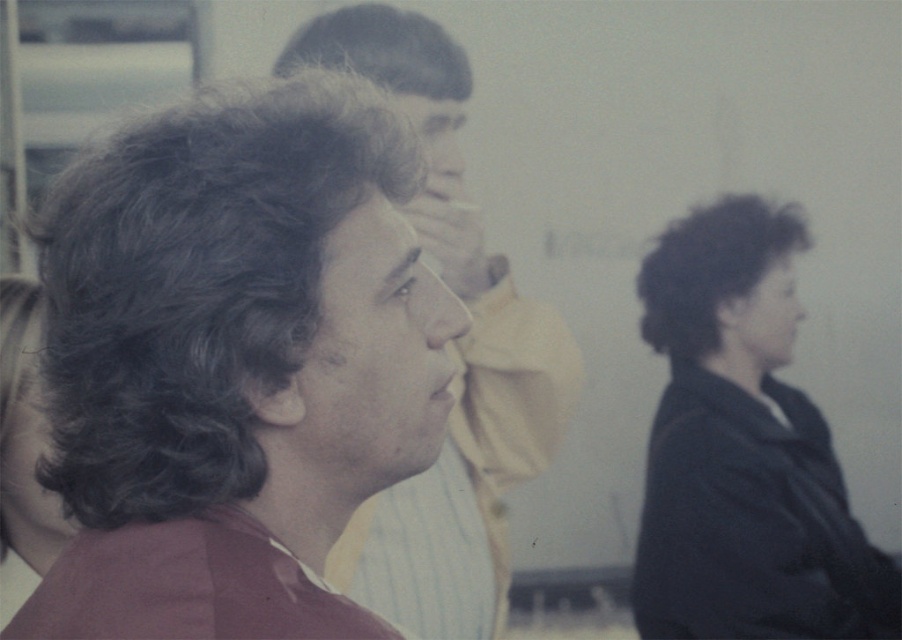
Question: Which point is farther to the camera?

Choices:
 (A) (448, 620)
 (B) (775, 602)

Answer: (B)

Question: Which object appears farthest from the camera in this image?

Choices:
 (A) dark brown hair at left
 (B) matte brown hair at center
 (C) black matte jacket at lower right

Answer: (C)

Question: Does dark brown hair at left appear over black matte jacket at lower right?

Choices:
 (A) no
 (B) yes

Answer: (B)

Question: Which point is farther from the camera taking this photo?

Choices:
 (A) (675, 324)
 (B) (376, 189)
 (C) (408, 29)

Answer: (A)

Question: Is dark brown hair at left to the left of matte brown hair at center from the viewer's perspective?

Choices:
 (A) yes
 (B) no

Answer: (A)

Question: Where is dark brown hair at left located in relation to matte brown hair at center in the image?

Choices:
 (A) left
 (B) right

Answer: (A)